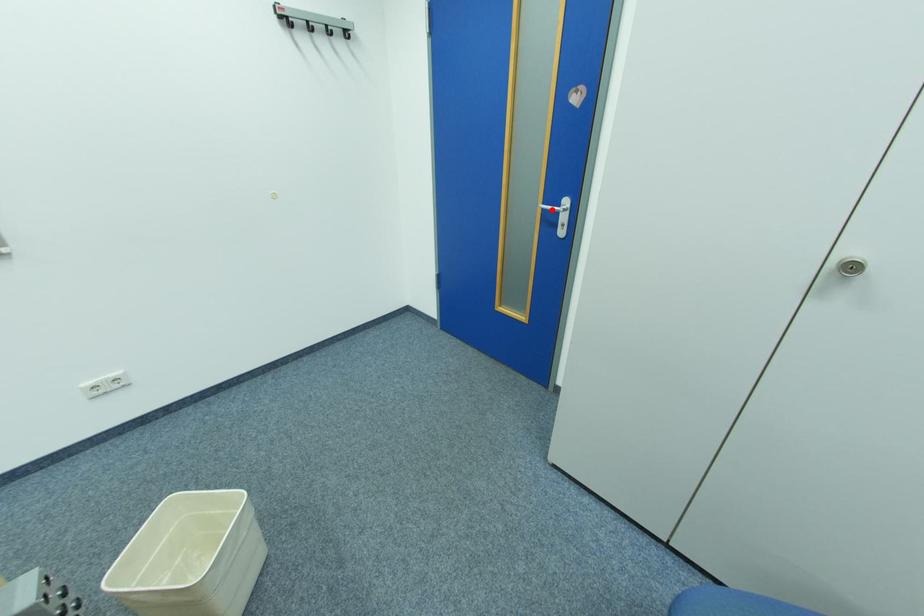
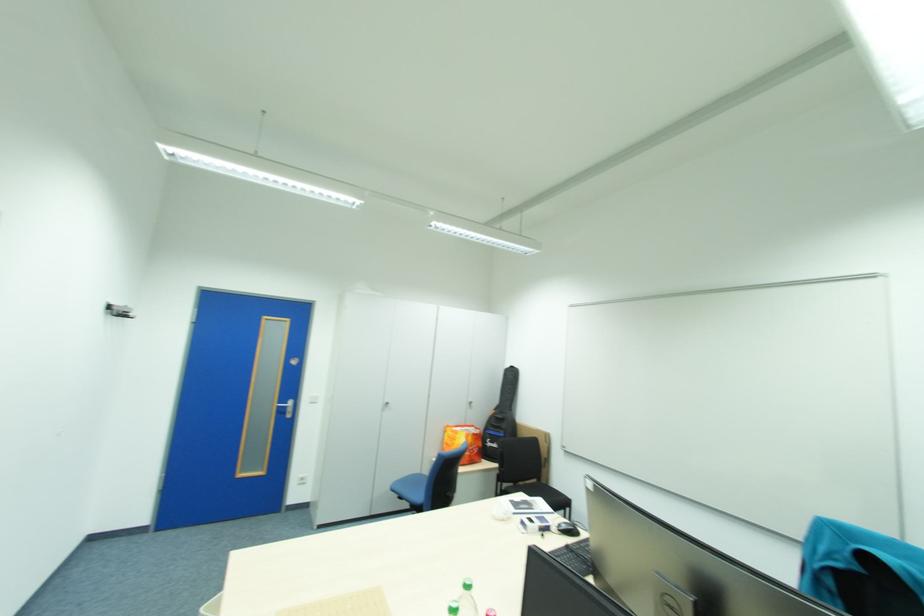
Question: I am providing you with two images of the same scene from different viewpoints. A red point is marked on the first image. At the location where the point appears in image 1, is it still visible in image 2?

Choices:
 (A) Yes
 (B) No

Answer: (A)